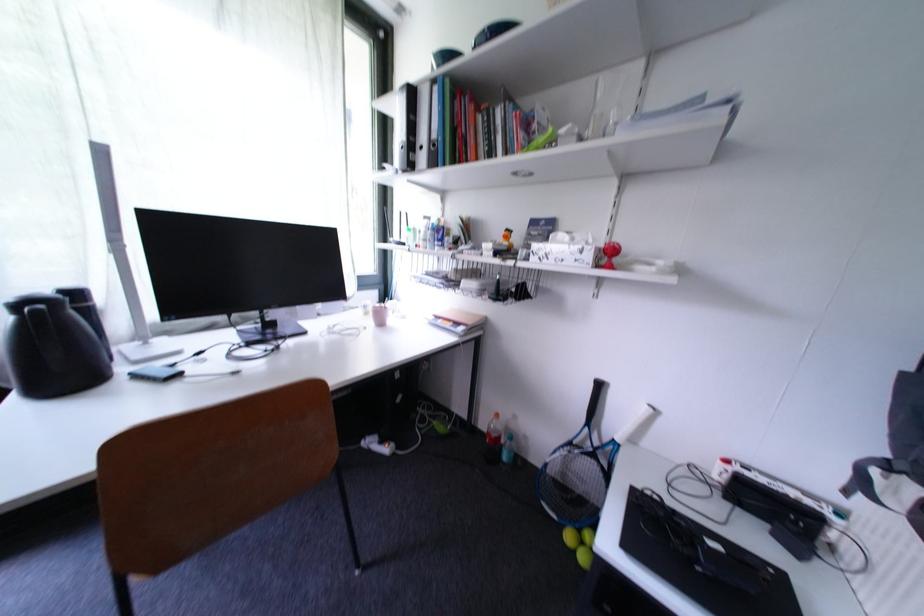
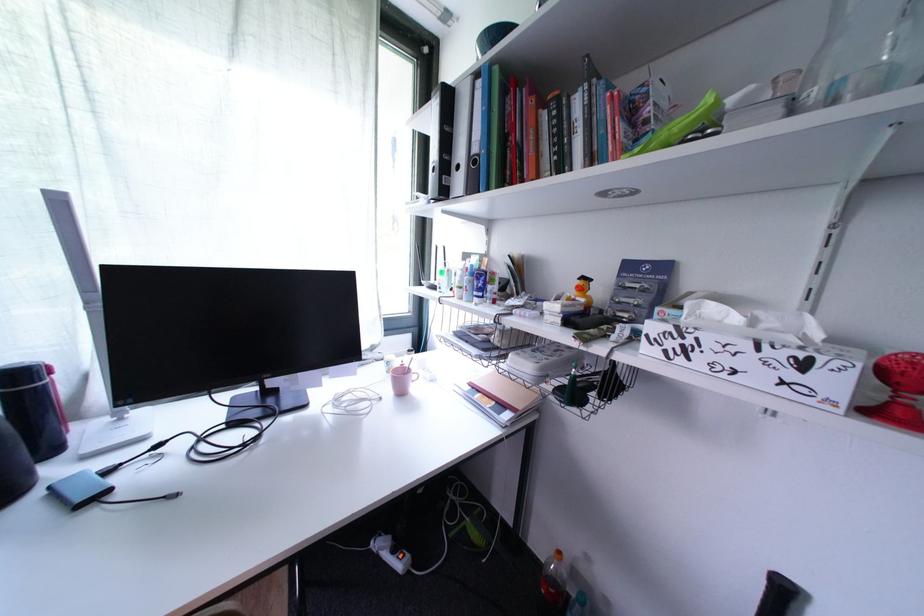
Question: Based on the continuous images, in which direction is the camera rotating? Reply with the corresponding letter.

Choices:
 (A) Left
 (B) Right
 (C) Up
 (D) Down

Answer: (A)